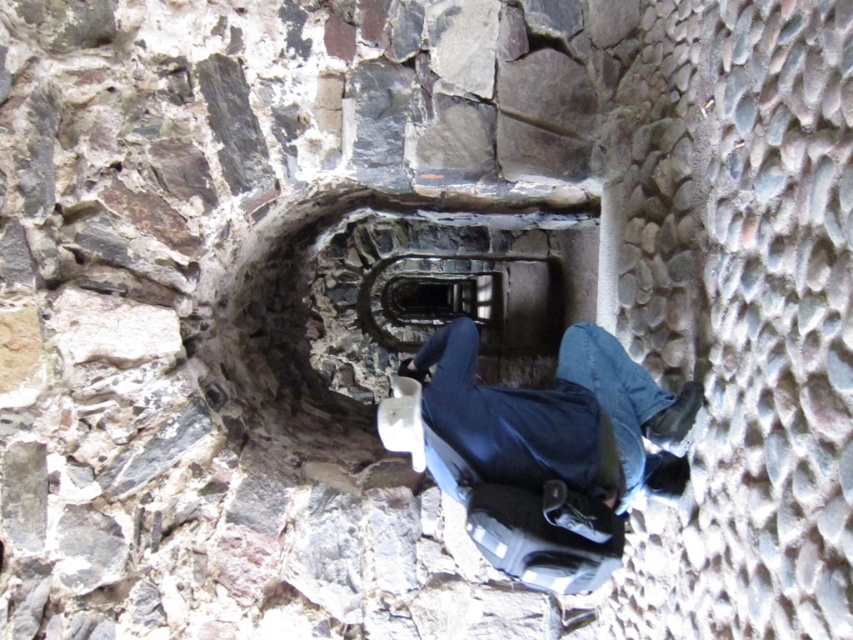
Question: Which point is farther to the camera?

Choices:
 (A) (463, 333)
 (B) (294, 358)

Answer: (B)

Question: Is blue denim jeans at center further to camera compared to metallic spiral staircase at center?

Choices:
 (A) no
 (B) yes

Answer: (A)

Question: Which of the following is the closest to the observer?

Choices:
 (A) metallic spiral staircase at center
 (B) blue denim jeans at center
 (C) dark stone staircase at center

Answer: (B)

Question: Is dark stone staircase at center wider than metallic spiral staircase at center?

Choices:
 (A) yes
 (B) no

Answer: (A)

Question: Which object is positioned closest to the dark stone staircase at center?

Choices:
 (A) metallic spiral staircase at center
 (B) blue denim jeans at center

Answer: (A)

Question: Where is blue denim jeans at center located in relation to dark stone staircase at center in the image?

Choices:
 (A) above
 (B) below

Answer: (B)